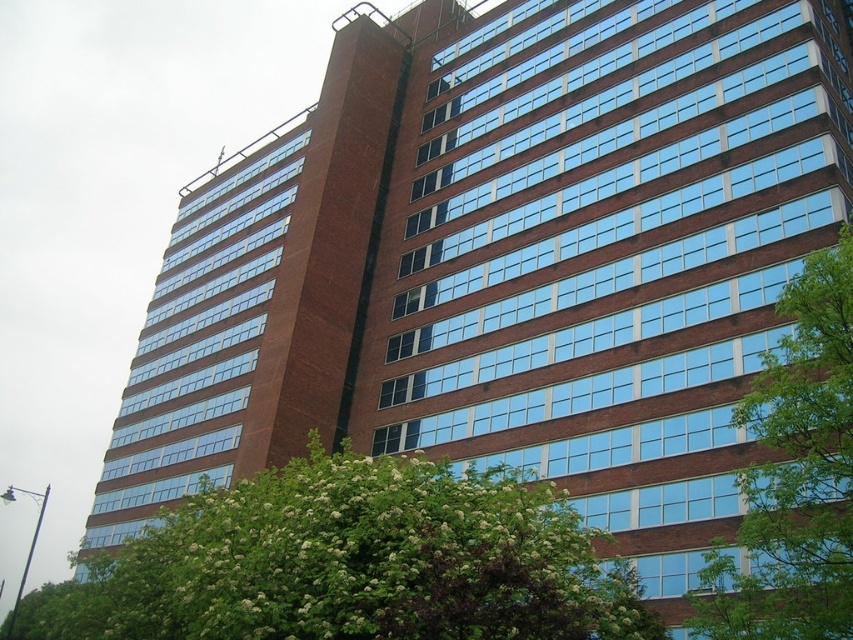
Question: Which of the following is the farthest from the observer?

Choices:
 (A) (796, 540)
 (B) (286, 605)

Answer: (B)

Question: Observing the image, what is the correct spatial positioning of green leafy tree at lower left in reference to green leafy tree at right?

Choices:
 (A) below
 (B) above

Answer: (A)

Question: Among these points, which one is nearest to the camera?

Choices:
 (A) (469, 481)
 (B) (769, 436)

Answer: (B)

Question: Is green leafy tree at lower left further to camera compared to green leafy tree at right?

Choices:
 (A) no
 (B) yes

Answer: (A)

Question: Does green leafy tree at lower left have a larger size compared to green leafy tree at right?

Choices:
 (A) yes
 (B) no

Answer: (A)